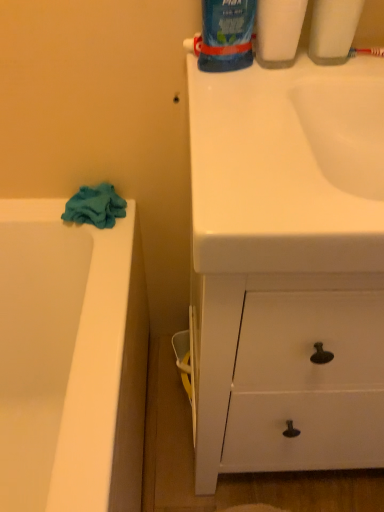
Question: Is teal fabric towel at left directly adjacent to blue glossy toothpaste tube at upper right, which is counted as the 1th cleaning product, starting from the right?

Choices:
 (A) yes
 (B) no

Answer: (B)

Question: Does teal fabric towel at left have a greater height compared to blue glossy toothpaste tube at upper right, which appears as the third cleaning product when viewed from the left?

Choices:
 (A) no
 (B) yes

Answer: (A)

Question: Would you say teal fabric towel at left is a long distance from blue glossy toothpaste tube at upper right, which is counted as the 1th cleaning product, starting from the right?

Choices:
 (A) no
 (B) yes

Answer: (A)

Question: Considering the relative sizes of teal fabric towel at left and blue glossy toothpaste tube at upper right, which appears as the third cleaning product when viewed from the left, in the image provided, is teal fabric towel at left smaller than blue glossy toothpaste tube at upper right, which appears as the third cleaning product when viewed from the left,?

Choices:
 (A) yes
 (B) no

Answer: (B)

Question: From a real-world perspective, is teal fabric towel at left positioned under blue glossy toothpaste tube at upper right, which appears as the third cleaning product when viewed from the left, based on gravity?

Choices:
 (A) no
 (B) yes

Answer: (B)

Question: From the image's perspective, is teal fabric towel at left located beneath blue glossy toothpaste tube at upper right, which is counted as the 1th cleaning product, starting from the right?

Choices:
 (A) no
 (B) yes

Answer: (B)

Question: Is red plastic toothbrush at upper right not within blue glossy bottle at upper center, placed as the second cleaning product when sorted from right to left?

Choices:
 (A) no
 (B) yes

Answer: (B)

Question: Can you confirm if red plastic toothbrush at upper right is positioned to the right of blue glossy bottle at upper center, placed as the second cleaning product when sorted from right to left?

Choices:
 (A) yes
 (B) no

Answer: (A)

Question: Does red plastic toothbrush at upper right have a lesser width compared to blue glossy bottle at upper center, placed as the second cleaning product when sorted from right to left?

Choices:
 (A) yes
 (B) no

Answer: (A)

Question: From a real-world perspective, is red plastic toothbrush at upper right positioned under blue glossy bottle at upper center, placed as the second cleaning product when sorted from right to left, based on gravity?

Choices:
 (A) yes
 (B) no

Answer: (A)

Question: Considering the relative sizes of red plastic toothbrush at upper right and blue glossy bottle at upper center, placed as the second cleaning product when sorted from right to left, in the image provided, is red plastic toothbrush at upper right taller than blue glossy bottle at upper center, placed as the second cleaning product when sorted from right to left,?

Choices:
 (A) no
 (B) yes

Answer: (A)

Question: Can you confirm if red plastic toothbrush at upper right is wider than blue glossy bottle at upper center, placed as the second cleaning product when sorted from right to left?

Choices:
 (A) no
 (B) yes

Answer: (A)

Question: Is blue glossy toothpaste tube at upper right, which is counted as the 1th cleaning product, starting from the right, positioned behind red plastic toothbrush at upper right?

Choices:
 (A) no
 (B) yes

Answer: (A)